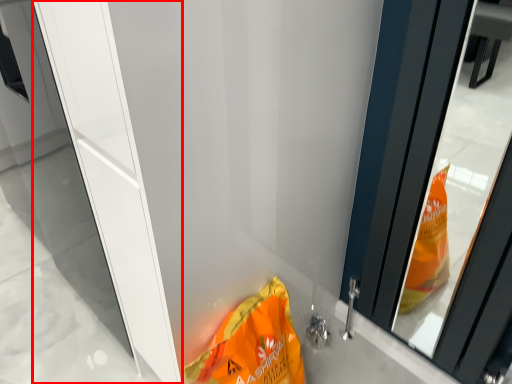
Question: From the image's perspective, considering the relative positions of screen door (annotated by the red box) and waste in the image provided, where is screen door (annotated by the red box) located with respect to the staircase?

Choices:
 (A) above
 (B) below

Answer: (A)